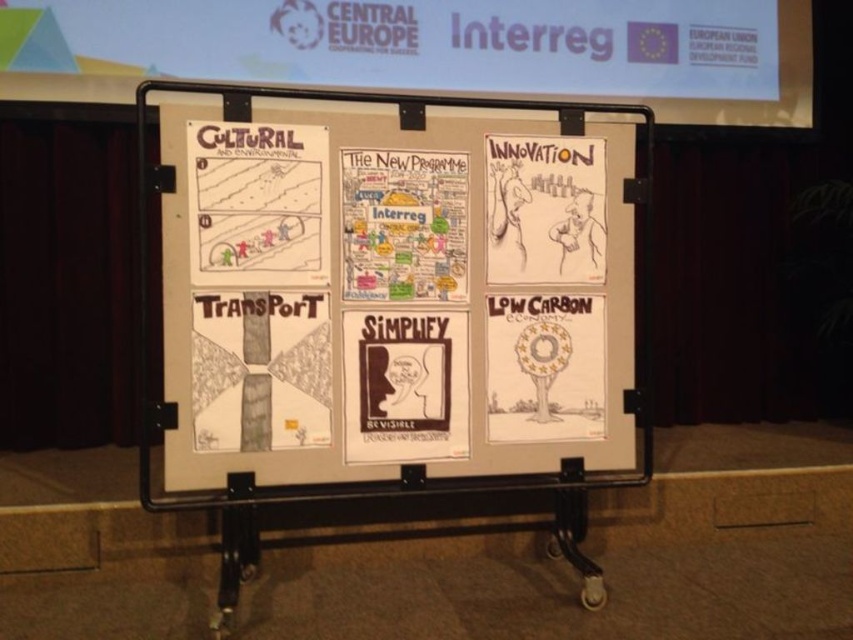
Looking at the top left section of the presentation board, you see the gray textured paper at lower left and the white paper tree at lower right. Which object is positioned to the left of the other?

The gray textured paper at lower left is to the left of the white paper tree at lower right.

Looking at the presentation board with the white paper at center and gray textured paper at lower left, which section has a greater height?

The white paper at center is taller than the gray textured paper at lower left.

Consider the image. You are an event organizer looking at the presentation board. You need to place a decorative ribbon that is 1 meter long horizontally between the gray textured paper at lower left and the white paper poster at center. Can the ribbon fit between them?

The gray textured paper at lower left is positioned on the left side of the white paper poster at center. Since the ribbon is 1 meter long and the distance between them isn